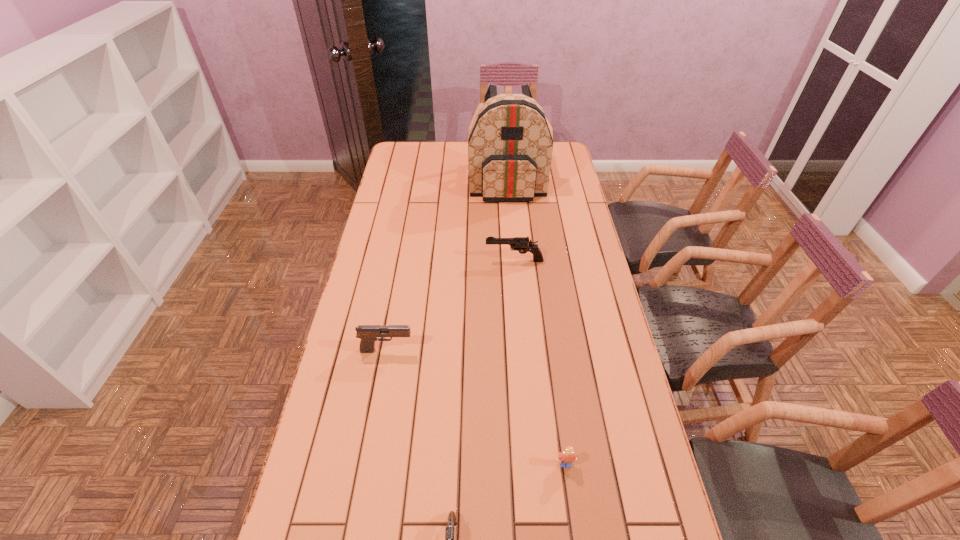
Locate an element on the screen. The image size is (960, 540). free location at the far right corner of the desktop is located at coordinates (560, 158).

Identify the location of vacant space that is in between the Lego and the right gun. (540, 362).

This screenshot has width=960, height=540. Identify the location of free spot between the pistol and the taller gun. (450, 305).

The image size is (960, 540). Find the location of `empty location between the third nearest object and the Lego`. empty location between the third nearest object and the Lego is located at coordinates (476, 407).

At what (x,y) coordinates should I click in order to perform the action: click on vacant region between the Lego and the leftmost object. Please return your answer as a coordinate pair (x, y). This screenshot has height=540, width=960. Looking at the image, I should click on (476, 407).

Locate an element on the screen. This screenshot has width=960, height=540. vacant area that lies between the backpack and the pistol is located at coordinates (447, 266).

Where is `vacant point located between the farthest object and the Lego`? vacant point located between the farthest object and the Lego is located at coordinates (536, 323).

Locate an element on the screen. The height and width of the screenshot is (540, 960). object that stands as the third closest to the Lego is located at coordinates (522, 244).

Where is `object that stands as the closest to the taller gun`? object that stands as the closest to the taller gun is located at coordinates coord(510,146).

The image size is (960, 540). What are the coordinates of `free space that satisfies the following two spatial constraints: 1. on the front face of the tallest object; 2. aim along the barrel of the third farthest object` in the screenshot? It's located at (520, 350).